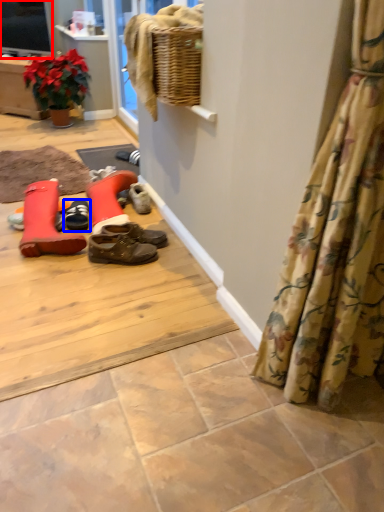
Question: Which point is closer to the camera, television (highlighted by a red box) or footwear (highlighted by a blue box)?

Choices:
 (A) television
 (B) footwear

Answer: (B)